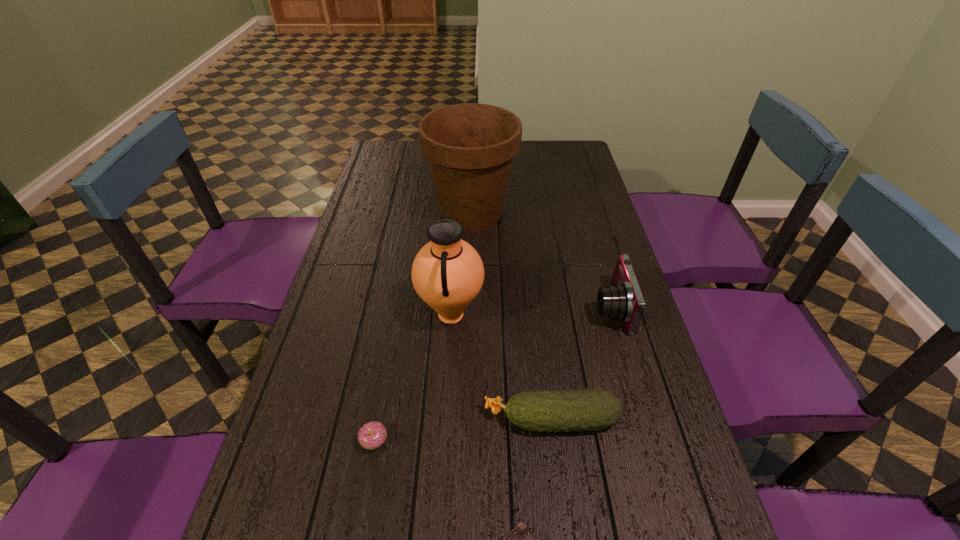
Where is `free location at the far left corner of the desktop`? free location at the far left corner of the desktop is located at coordinates (389, 161).

The width and height of the screenshot is (960, 540). I want to click on free space between the leftmost object and the flowerpot, so click(x=423, y=327).

Identify the location of empty space that is in between the pitcher and the cucumber. The height and width of the screenshot is (540, 960). (501, 367).

Find the location of a particular element. empty space between the cucumber and the pitcher is located at coordinates (501, 367).

This screenshot has height=540, width=960. In order to click on vacant area that lies between the farthest object and the cupcake in this screenshot , I will do `click(423, 327)`.

The image size is (960, 540). In order to click on empty space that is in between the cucumber and the pitcher in this screenshot , I will do 501,367.

Where is `empty space between the pitcher and the cucumber`? empty space between the pitcher and the cucumber is located at coordinates click(501, 367).

Locate an element on the screen. Image resolution: width=960 pixels, height=540 pixels. vacant area that lies between the third tallest object and the cucumber is located at coordinates (582, 364).

At what (x,y) coordinates should I click in order to perform the action: click on vacant space that's between the cucumber and the camera. Please return your answer as a coordinate pair (x, y). The image size is (960, 540). Looking at the image, I should click on (582, 364).

This screenshot has height=540, width=960. Identify the location of free space between the cupcake and the rightmost object. tap(492, 375).